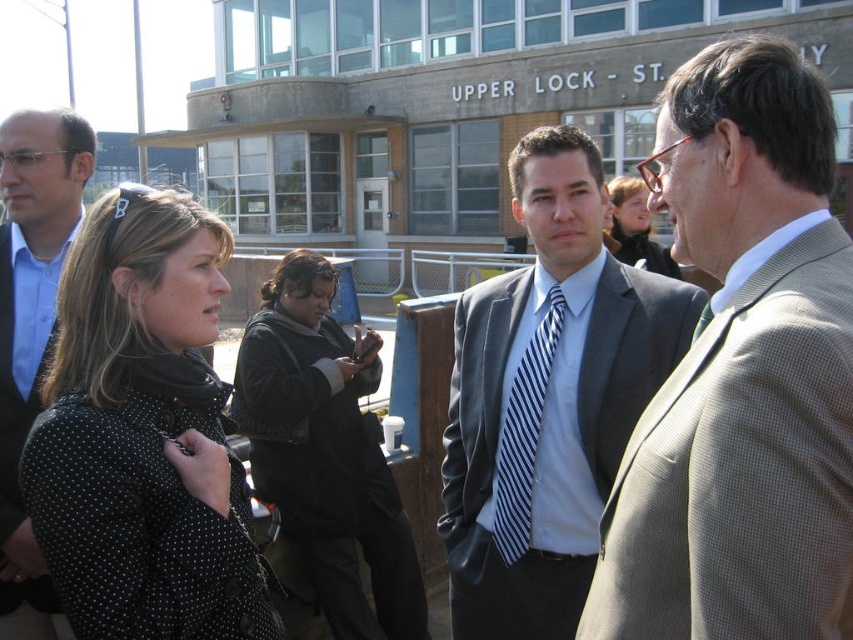
Looking at this image, you are a photographer positioned at the back of the group. You want to take a photo that focuses on the dark gray suit at center and the matte black jacket at center. Which one will appear larger in the photo?

The dark gray suit at center will appear larger in the photo because it is closer to the viewer than the matte black jacket at center.

From the picture: You are a photographer trying to capture a candid shot of the group. You want to ensure both the gray checkered suit at center and the black dotted coat at left are in frame. Based on their positions, which direction should you move to include both subjects?

Since the gray checkered suit at center is to the right of the black dotted coat at left, you should move to the left to ensure both subjects are in frame.